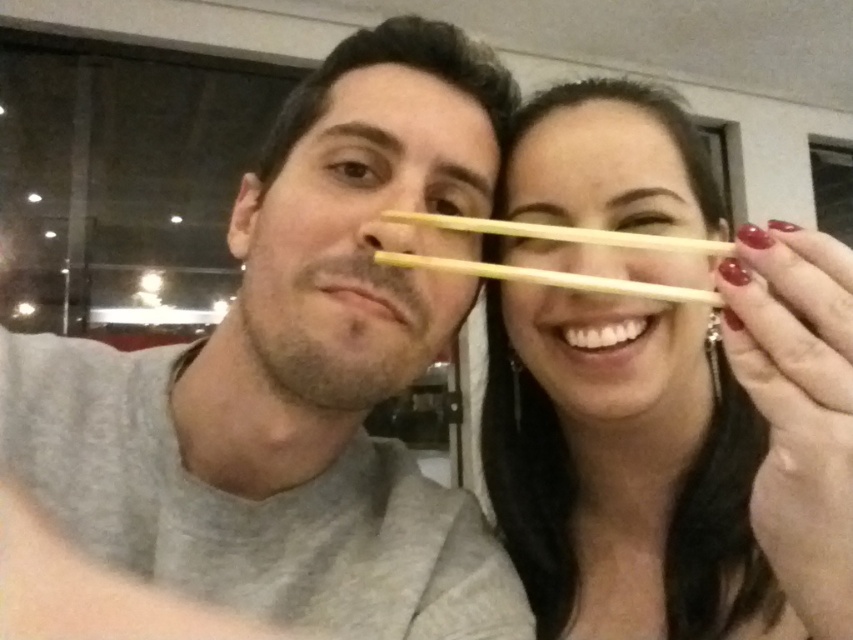
Question: Which of the following is the farthest from the observer?

Choices:
 (A) wooden chopsticks at center
 (B) smooth wood chopsticks at upper right
 (C) matte gray shirt at center

Answer: (C)

Question: Is smooth wood chopsticks at upper right smaller than wooden chopsticks at center?

Choices:
 (A) yes
 (B) no

Answer: (B)

Question: Considering the real-world distances, which object is closest to the matte gray shirt at center?

Choices:
 (A) smooth wood chopsticks at upper right
 (B) wooden chopsticks at center

Answer: (B)

Question: Is smooth wood chopsticks at upper right to the left of wooden chopsticks at center from the viewer's perspective?

Choices:
 (A) yes
 (B) no

Answer: (B)

Question: Which point is closer to the camera?

Choices:
 (A) smooth wood chopsticks at upper right
 (B) wooden chopsticks at center

Answer: (A)

Question: Is matte gray shirt at center positioned behind wooden chopsticks at center?

Choices:
 (A) no
 (B) yes

Answer: (B)